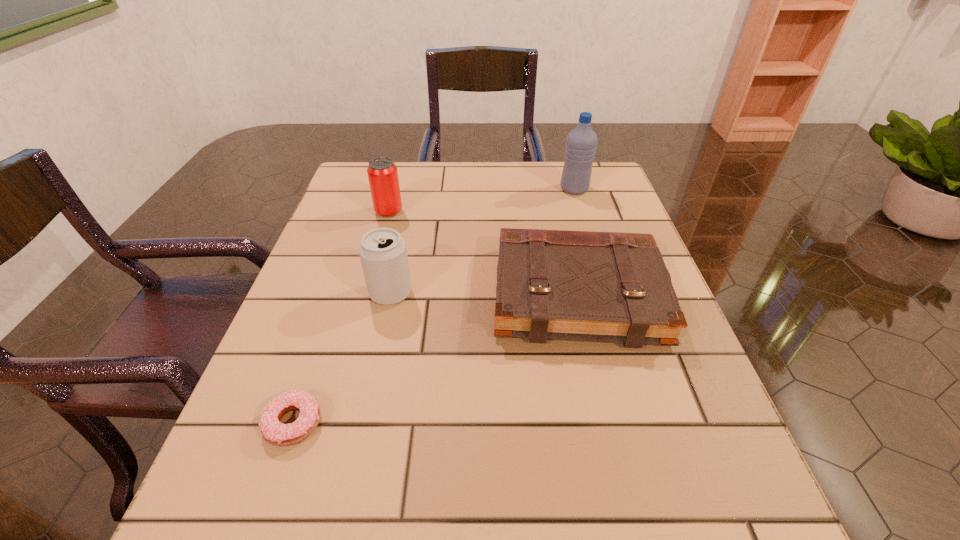
Where is `the tallest object`? Image resolution: width=960 pixels, height=540 pixels. the tallest object is located at coordinates (581, 143).

This screenshot has height=540, width=960. Find the location of `the farthest object`. the farthest object is located at coordinates (581, 143).

Locate an element on the screen. The height and width of the screenshot is (540, 960). the nearer can is located at coordinates (383, 254).

In order to click on the farther can in this screenshot , I will do `click(382, 172)`.

You are a GUI agent. You are given a task and a screenshot of the screen. Output one action in this format:
    pyautogui.click(x=<x>, y=<y>)
    Task: Click on the second shortest object
    Image resolution: width=960 pixels, height=540 pixels.
    Given the screenshot: What is the action you would take?
    pyautogui.click(x=551, y=284)

At what (x,y) coordinates should I click in order to perform the action: click on the shortest object. Please return your answer as a coordinate pair (x, y). Looking at the image, I should click on click(x=279, y=434).

This screenshot has height=540, width=960. What are the coordinates of `doughnut` in the screenshot? It's located at (279, 434).

The width and height of the screenshot is (960, 540). I want to click on free location located on the front of the farthest object, so click(x=610, y=307).

Identify the location of vacant space situated on the front of the nearer can. (357, 446).

In order to click on free space located 0.300m on the front of the second farthest object in this screenshot , I will do `click(362, 309)`.